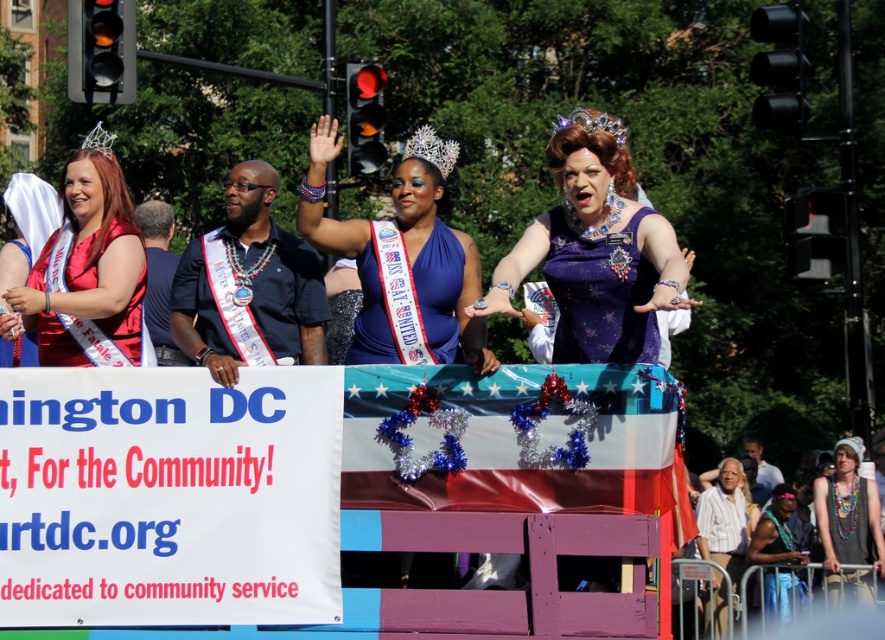
Measure the distance between shiny blue dress at center and camera.

A distance of 41.66 meters exists between shiny blue dress at center and camera.

Does shiny blue dress at center have a greater height compared to beige fabric tank top at lower right?

Yes, shiny blue dress at center is taller than beige fabric tank top at lower right.

What are the coordinates of `shiny blue dress at center` in the screenshot? It's located at (408, 275).

Find the location of `sparkly purple dress at center`. sparkly purple dress at center is located at coordinates (596, 252).

Who is more forward, (582,264) or (339,140)?

Point (582,264) is more forward.

Where is `sparkly purple dress at center`? The width and height of the screenshot is (885, 640). sparkly purple dress at center is located at coordinates (596, 252).

Which is behind, point (67, 248) or point (832, 502)?

The point (832, 502) is more distant.

The height and width of the screenshot is (640, 885). I want to click on matte red dress at left, so click(x=87, y=272).

Is point (114, 362) less distant than point (850, 532)?

Yes.

Where is `matte red dress at left`? matte red dress at left is located at coordinates (87, 272).